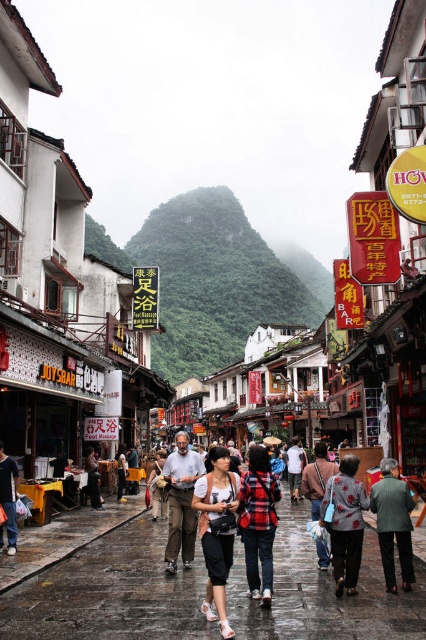
You are a photographer standing on the street and want to capture both the green textured mountain at center and the light brown leather jacket at center in a single frame. Which object should you zoom in on to ensure both are visible without cropping?

The green textured mountain at center might be wider than the light brown leather jacket at center, so you should zoom in on the wider object to include both in the frame.

You are a tailor observing a busy street scene. You notice two garments displayed in store windows. The first is a red plaid shirt at center, and the second is a dark gray fabric jacket at lower right. Which garment has a greater width when laid flat?

The red plaid shirt at center has a greater width than the dark gray fabric jacket at lower right when laid flat, as stated in the description that the red plaid shirt at center surpasses the jacket in width.